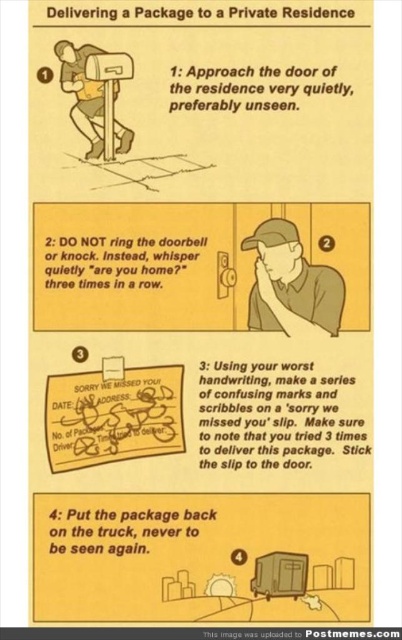
Who is positioned more to the left, brown cap at center or metallic mailbox at upper left?

metallic mailbox at upper left is more to the left.

Is brown cap at center further to camera compared to metallic mailbox at upper left?

Yes, it is behind metallic mailbox at upper left.

Where is `brown cap at center`? brown cap at center is located at coordinates (291, 284).